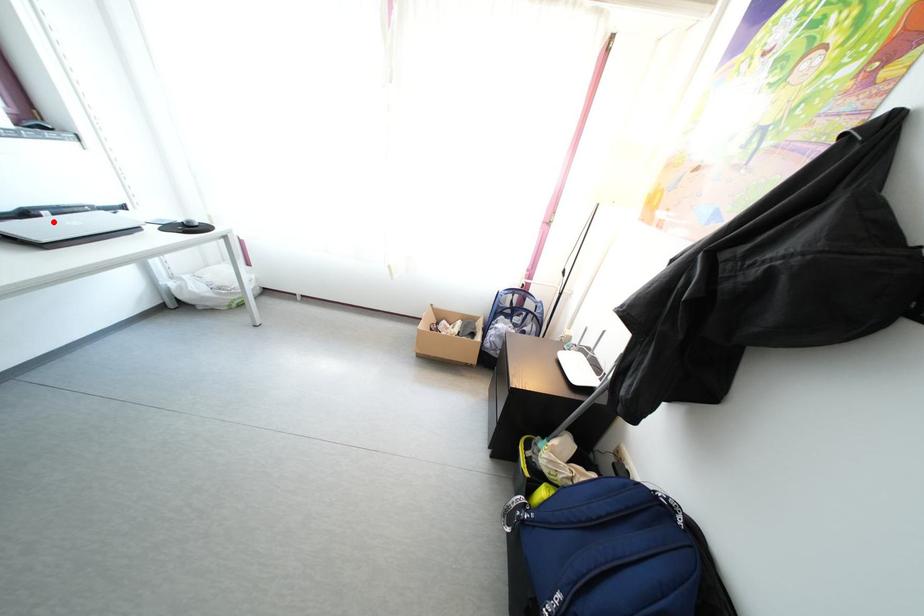
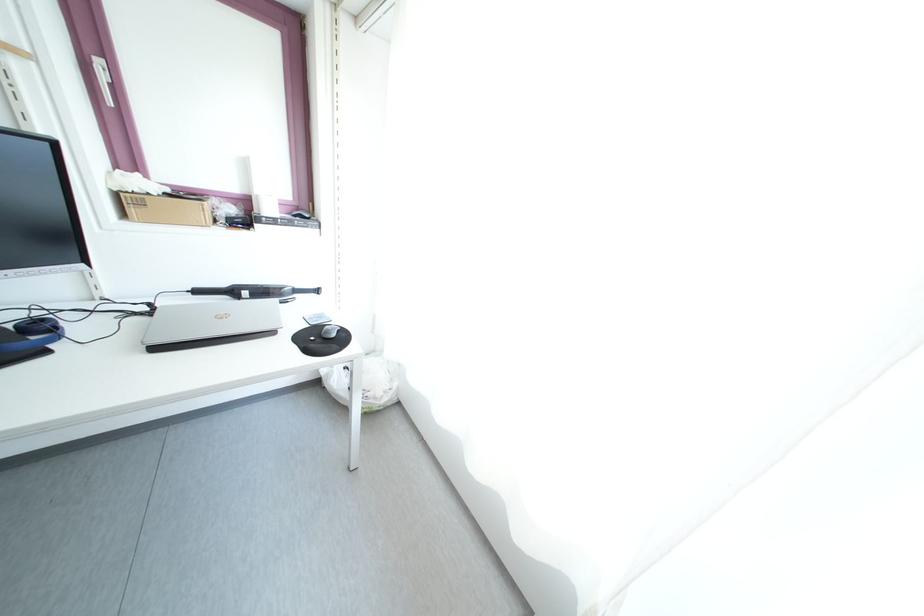
Question: I am providing you with two images of the same scene from different viewpoints. In image1, a red point is highlighted. Considering the same 3D point in image2, which of the following is correct?

Choices:
 (A) It is closer
 (B) It is farther

Answer: (A)